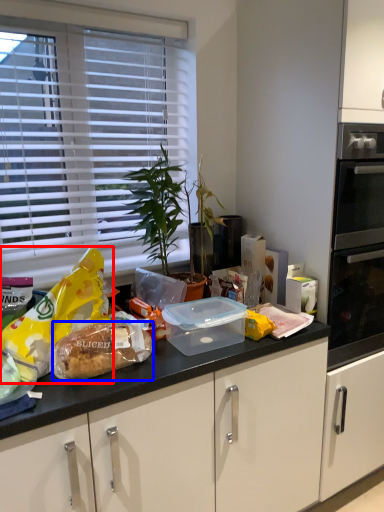
Question: Which object is closer to the camera taking this photo, snack (highlighted by a red box) or food (highlighted by a blue box)?

Choices:
 (A) snack
 (B) food

Answer: (A)